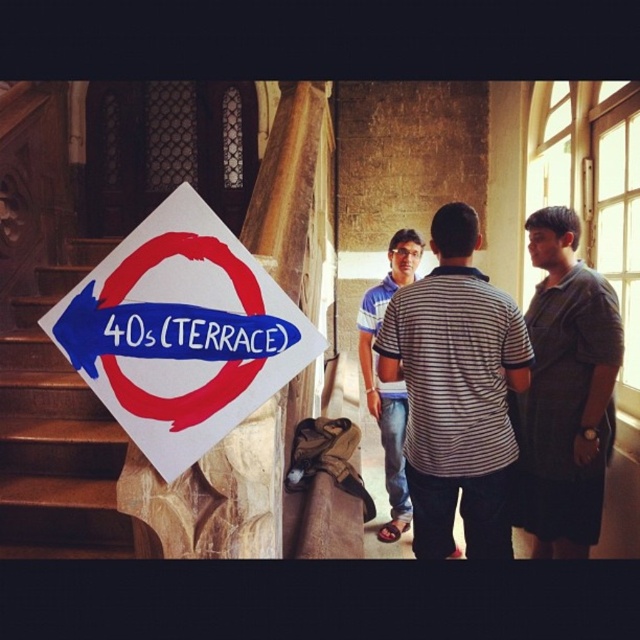
Question: Is striped cotton shirt at center positioned in front of wooden staircase at left?

Choices:
 (A) no
 (B) yes

Answer: (B)

Question: Is striped cotton shirt at center bigger than wooden staircase at left?

Choices:
 (A) no
 (B) yes

Answer: (A)

Question: Among these objects, which one is nearest to the camera?

Choices:
 (A) white paper sign at upper left
 (B) blue striped shirt at center
 (C) dark gray striped shirt at right

Answer: (A)

Question: Can you confirm if white paper sign at upper left is positioned below striped cotton shirt at center?

Choices:
 (A) yes
 (B) no

Answer: (B)

Question: Which point is closer to the camera taking this photo?

Choices:
 (A) 420,237
 (B) 218,216
 (C) 483,440
 (D) 554,506

Answer: (B)

Question: Which point is closer to the camera?

Choices:
 (A) (602, 412)
 (B) (266, 308)

Answer: (B)